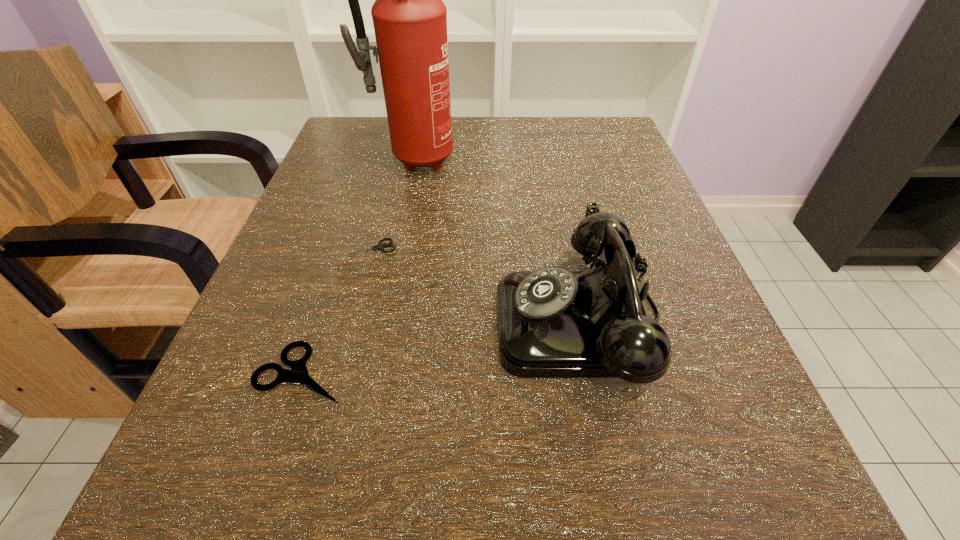
In order to click on the farthest object in this screenshot , I will do `click(410, 19)`.

You are a GUI agent. You are given a task and a screenshot of the screen. Output one action in this format:
    pyautogui.click(x=<x>, y=<y>)
    Task: Click on the tallest object
    This screenshot has width=960, height=540.
    Given the screenshot: What is the action you would take?
    pyautogui.click(x=410, y=19)

At what (x,y) coordinates should I click in order to perform the action: click on the rightmost object. Please return your answer as a coordinate pair (x, y). This screenshot has height=540, width=960. Looking at the image, I should click on (552, 323).

Locate an element on the screen. The height and width of the screenshot is (540, 960). the third shortest object is located at coordinates (552, 323).

Where is `the nearer shears`? This screenshot has width=960, height=540. the nearer shears is located at coordinates (298, 374).

Where is `the taller shears`? Image resolution: width=960 pixels, height=540 pixels. the taller shears is located at coordinates (298, 374).

Locate an element on the screen. the shorter shears is located at coordinates pyautogui.click(x=379, y=246).

This screenshot has height=540, width=960. I want to click on the farther shears, so click(x=379, y=246).

What are the coordinates of `free space located 0.270m at the nozzle of the tallest object` in the screenshot? It's located at (385, 274).

You are a GUI agent. You are given a task and a screenshot of the screen. Output one action in this format:
    pyautogui.click(x=<x>, y=<y>)
    Task: Click on the free space located on the dial of the rightmost object
    
    Given the screenshot: What is the action you would take?
    pyautogui.click(x=266, y=321)